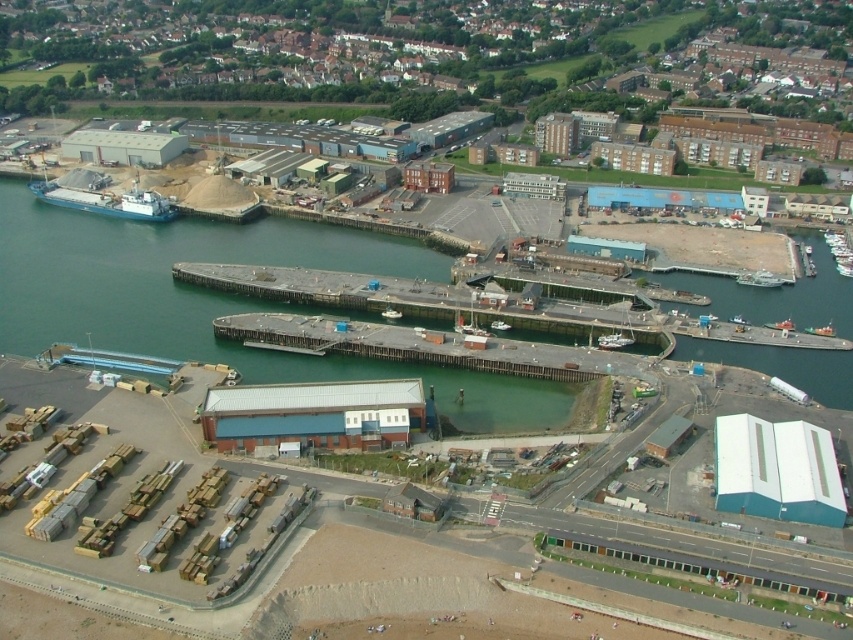
Question: Is blue metallic barge at left positioned in front of metallic gray ship at center?

Choices:
 (A) no
 (B) yes

Answer: (A)

Question: Based on their relative distances, which object is farther from the metallic gray ship at center?

Choices:
 (A) metallic gray boat at center
 (B) white plastic boat at center
 (C) blue metallic barge at left
 (D) green matte cargo ship at center

Answer: (C)

Question: Among these objects, which one is nearest to the camera?

Choices:
 (A) white plastic boat at center
 (B) metallic gray ship at center

Answer: (A)

Question: Can you confirm if blue metallic barge at left is positioned above green matte cargo ship at center?

Choices:
 (A) no
 (B) yes

Answer: (B)

Question: Which point is closer to the camera?

Choices:
 (A) white plastic boat at center
 (B) blue metallic barge at left
 (C) green matte cargo ship at center
 (D) metallic gray ship at center

Answer: (C)

Question: Is metallic gray boat at center to the left of green matte cargo ship at center from the viewer's perspective?

Choices:
 (A) no
 (B) yes

Answer: (B)